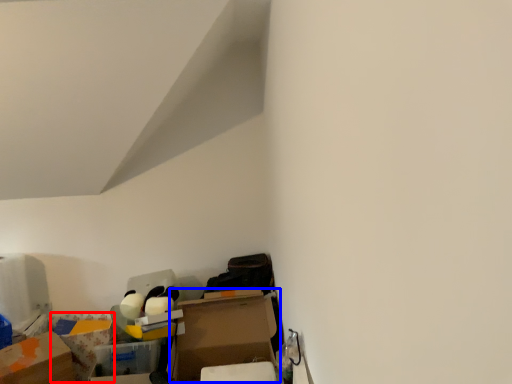
Question: Which object is closer to the camera taking this photo, storage box (highlighted by a red box) or cardboard box (highlighted by a blue box)?

Choices:
 (A) storage box
 (B) cardboard box

Answer: (B)